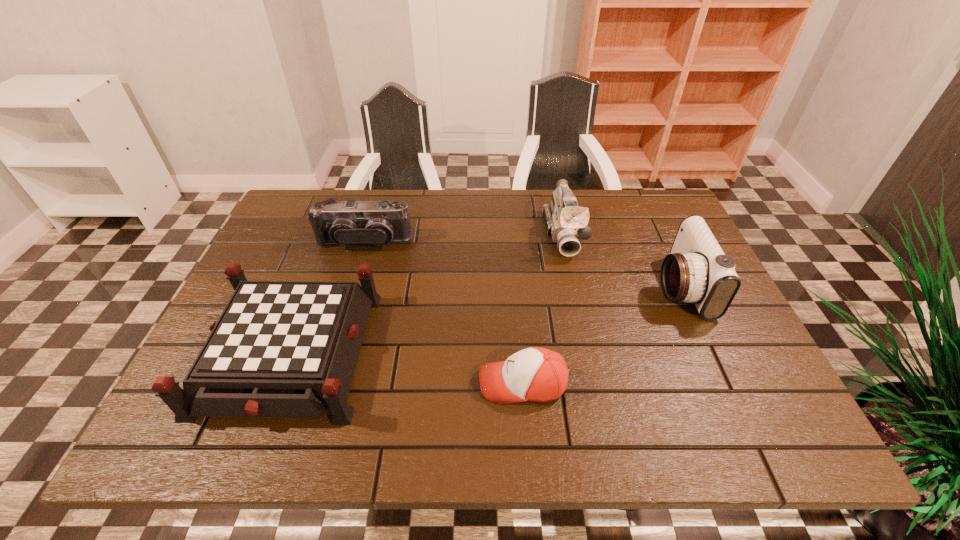
You are a GUI agent. You are given a task and a screenshot of the screen. Output one action in this format:
    pyautogui.click(x=<x>, y=<y>)
    Task: Click on the vacant region between the rightmost object and the third object from right to left
    Image resolution: width=960 pixels, height=540 pixels.
    Given the screenshot: What is the action you would take?
    pyautogui.click(x=602, y=335)

Locate an element on the screen. Image resolution: width=960 pixels, height=540 pixels. free spot between the baseball cap and the checkerboard is located at coordinates (406, 368).

Find the location of a particular element. Image resolution: width=960 pixels, height=540 pixels. vacant region between the second camcorder from left to right and the third object from right to left is located at coordinates (543, 309).

In order to click on vacant point located between the fourth object from left to right and the rightmost object in this screenshot , I will do `click(622, 260)`.

Select which object is the second closest to the leftmost camcorder. Please provide its 2D coordinates. Your answer should be formatted as a tuple, i.e. [(x, y)], where the tuple contains the x and y coordinates of a point satisfying the conditions above.

[(566, 222)]

The width and height of the screenshot is (960, 540). I want to click on the closest object relative to the shortest object, so click(280, 348).

The height and width of the screenshot is (540, 960). I want to click on camcorder that is the second nearest to the checkerboard, so click(566, 222).

Identify the location of camcorder that can be found as the second closest to the leftmost camcorder. (697, 271).

Where is `vacant space that satisfies the following two spatial constraints: 1. on the surface of the rightmost object; 2. on the front side of the checkerboard`? The width and height of the screenshot is (960, 540). vacant space that satisfies the following two spatial constraints: 1. on the surface of the rightmost object; 2. on the front side of the checkerboard is located at coordinates (711, 353).

Where is `vacant space that satisfies the following two spatial constraints: 1. on the front-facing side of the second camcorder from right to left; 2. on the front-facing side of the third object from right to left`? vacant space that satisfies the following two spatial constraints: 1. on the front-facing side of the second camcorder from right to left; 2. on the front-facing side of the third object from right to left is located at coordinates click(x=596, y=383).